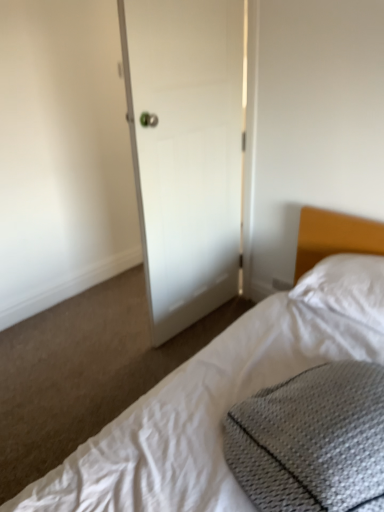
Describe the element at coordinates (210, 406) in the screenshot. The height and width of the screenshot is (512, 384). I see `white textured bed at lower right` at that location.

This screenshot has width=384, height=512. Find the location of `white soft pillow at right`. white soft pillow at right is located at coordinates (346, 287).

This screenshot has width=384, height=512. Describe the element at coordinates (185, 151) in the screenshot. I see `white matte door at center` at that location.

Find the location of a particular element. Image resolution: width=384 pixels, height=512 pixels. white textured bed at lower right is located at coordinates pyautogui.click(x=210, y=406).

Between white textured bed at lower right and white matte door at center, which one is positioned behind?

white matte door at center.

Is point (240, 340) closer or farther from the camera than point (189, 35)?

Point (240, 340).

From the image's perspective, is white textured bed at lower right located above white matte door at center?

No, from the image's perspective, white textured bed at lower right is not over white matte door at center.

Which is correct: white textured bed at lower right is inside white matte door at center, or outside of it?

white textured bed at lower right exists outside the volume of white matte door at center.

Would you say white matte door at center is inside or outside gray textured pillow at lower right?

white matte door at center lies outside gray textured pillow at lower right.

From the image's perspective, between white matte door at center and gray textured pillow at lower right, who is located below?

gray textured pillow at lower right.

Can you confirm if white matte door at center is wider than white soft pillow at right?

No, white matte door at center is not wider than white soft pillow at right.

Can you confirm if white matte door at center is positioned to the right of white soft pillow at right?

In fact, white matte door at center is to the left of white soft pillow at right.

From a real-world perspective, does white matte door at center sit lower than white soft pillow at right?

Actually, white matte door at center is physically above white soft pillow at right in the real world.

Is white matte door at center directly adjacent to white soft pillow at right?

white matte door at center and white soft pillow at right are clearly separated.

Is gray textured pillow at lower right in contact with white soft pillow at right?

No, gray textured pillow at lower right is not making contact with white soft pillow at right.

Considering the points (379, 466) and (322, 286), which point is behind, point (379, 466) or point (322, 286)?

Point (322, 286)

How far apart are gray textured pillow at lower right and white soft pillow at right?

gray textured pillow at lower right is 25.71 inches away from white soft pillow at right.

Consider the image. Considering the sizes of objects gray textured pillow at lower right and white soft pillow at right in the image provided, who is bigger, gray textured pillow at lower right or white soft pillow at right?

gray textured pillow at lower right is bigger.

From the picture: Is gray textured pillow at lower right shorter than white matte door at center?

Yes.

Choose the correct answer: Is gray textured pillow at lower right inside white matte door at center or outside it?

The correct answer is: outside.

Considering the positions of objects white matte door at center and white textured bed at lower right in the image provided, who is more to the left, white matte door at center or white textured bed at lower right?

white matte door at center.

Which object is more forward, white matte door at center or white textured bed at lower right?

white textured bed at lower right is more forward.

Which is correct: white matte door at center is inside white textured bed at lower right, or outside of it?

The correct answer is: outside.

How different are the orientations of white matte door at center and white textured bed at lower right in degrees?

They differ by 89.7 degrees in their facing directions.

From the image's perspective, is white soft pillow at right positioned above or below white textured bed at lower right?

From the image's perspective, white soft pillow at right appears above white textured bed at lower right.

Is white soft pillow at right facing away from white textured bed at lower right?

Correct, white soft pillow at right is looking away from white textured bed at lower right.

Is white soft pillow at right closer to the viewer compared to white textured bed at lower right?

No, it is not.

From the picture: Between white soft pillow at right and white textured bed at lower right, which one has more height?

Standing taller between the two is white textured bed at lower right.

I want to click on door above the white textured bed at lower right (from the image's perspective), so click(185, 151).

Where is `door behind the gray textured pillow at lower right`? This screenshot has height=512, width=384. door behind the gray textured pillow at lower right is located at coordinates (185, 151).

Considering their positions, is gray textured pillow at lower right positioned further to white soft pillow at right than white matte door at center?

Among the two, white matte door at center is located further to white soft pillow at right.

Considering their positions, is gray textured pillow at lower right positioned further to white textured bed at lower right than white soft pillow at right?

gray textured pillow at lower right lies further to white textured bed at lower right than the other object.

Considering their positions, is gray textured pillow at lower right positioned closer to white matte door at center than white soft pillow at right?

The object closer to white matte door at center is white soft pillow at right.

From the image, which object appears to be nearer to white textured bed at lower right, white soft pillow at right or white matte door at center?

Based on the image, white soft pillow at right appears to be nearer to white textured bed at lower right.

When comparing their distances from white matte door at center, does white textured bed at lower right or gray textured pillow at lower right seem further?

gray textured pillow at lower right is positioned further to the anchor white matte door at center.

Based on their spatial positions, is white matte door at center or white soft pillow at right further from gray textured pillow at lower right?

white matte door at center is positioned further to the anchor gray textured pillow at lower right.

Based on their spatial positions, is white textured bed at lower right or white matte door at center further from white soft pillow at right?

white matte door at center is further to white soft pillow at right.

Considering their positions, is white soft pillow at right positioned further to gray textured pillow at lower right than white matte door at center?

white matte door at center.

I want to click on material between white textured bed at lower right and white matte door at center from front to back, so click(312, 441).

Identify the location of pillow positioned between white textured bed at lower right and white matte door at center from near to far. [346, 287].

Identify the location of material positioned between white textured bed at lower right and white soft pillow at right from near to far. The width and height of the screenshot is (384, 512). (312, 441).

At what (x,y) coordinates should I click in order to perform the action: click on pillow between gray textured pillow at lower right and white matte door at center in the front-back direction. Please return your answer as a coordinate pair (x, y). The image size is (384, 512). Looking at the image, I should click on (346, 287).